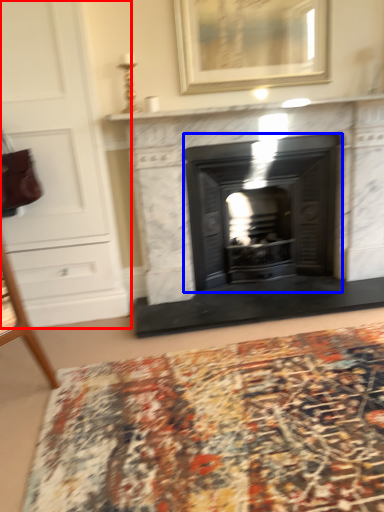
Question: Which point is closer to the camera, dresser (highlighted by a red box) or wood burning stove (highlighted by a blue box)?

Choices:
 (A) dresser
 (B) wood burning stove

Answer: (A)